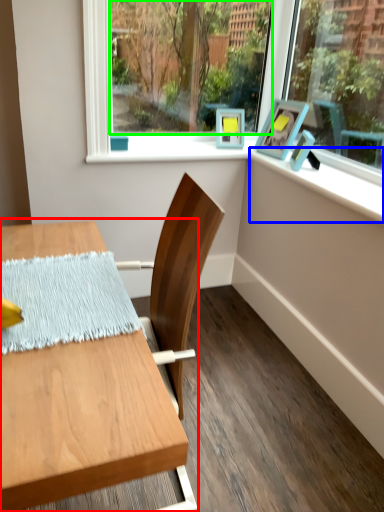
Question: Which object is the farthest from table (highlighted by a red box)? Choose among these: window sill (highlighted by a blue box) or window screen (highlighted by a green box).

Choices:
 (A) window sill
 (B) window screen

Answer: (B)